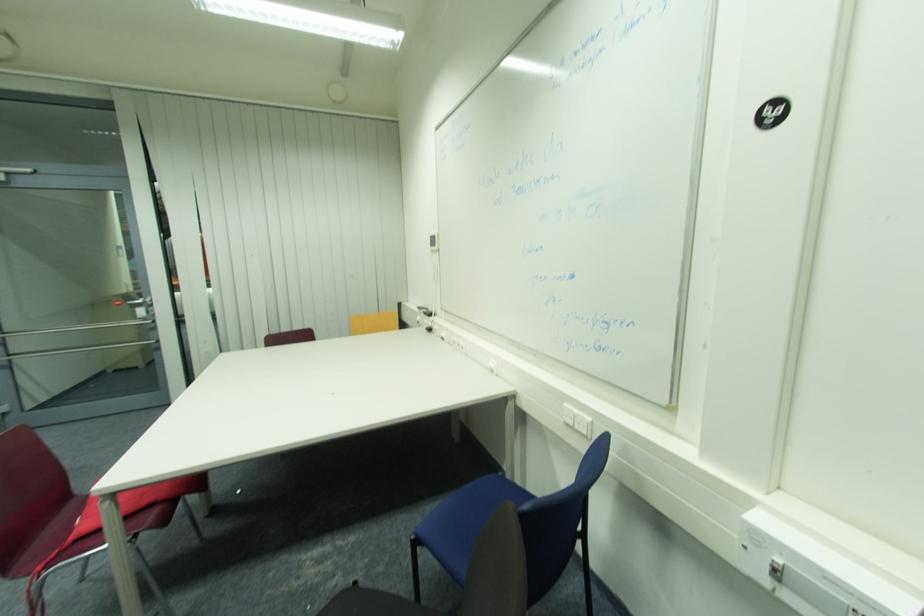
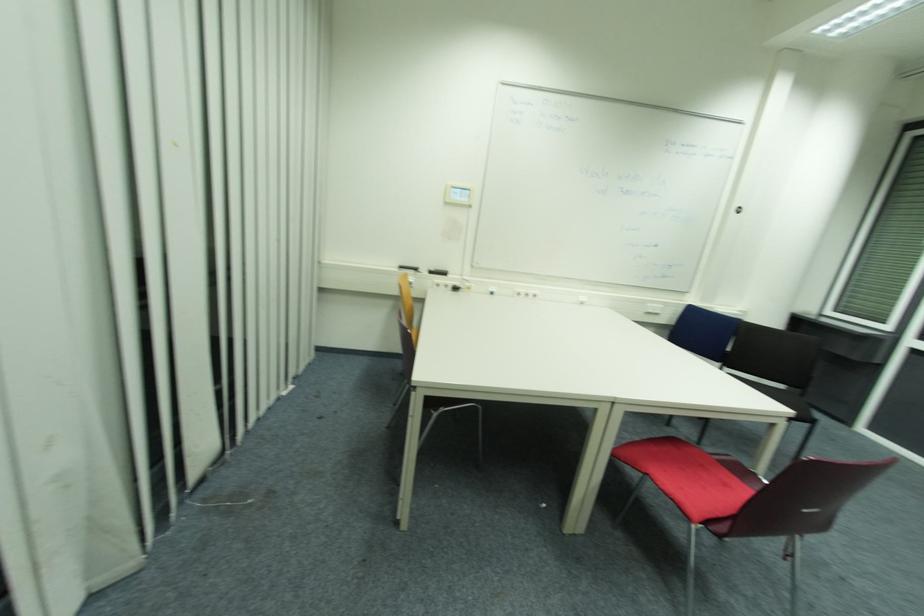
Locate, in the second image, the point that corresponds to (x=581, y=413) in the first image.

(658, 306)